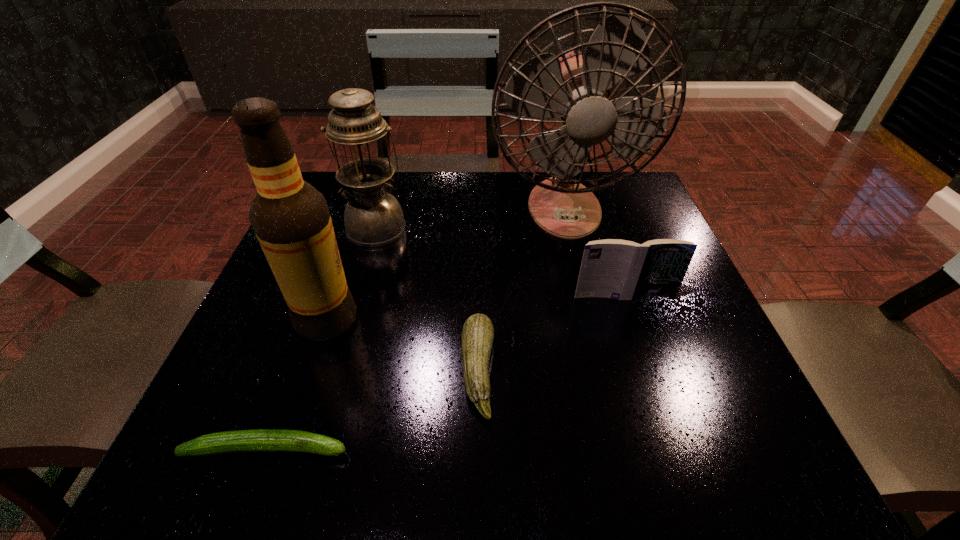
Locate an element on the screen. free space that is in between the shortest object and the fan is located at coordinates (416, 329).

Image resolution: width=960 pixels, height=540 pixels. I want to click on free spot between the farther zucchini and the alcohol, so click(402, 346).

Find the location of a particular element. This screenshot has width=960, height=540. free space between the third tallest object and the fan is located at coordinates (470, 218).

Locate an element on the screen. This screenshot has width=960, height=540. free space between the book and the shortest object is located at coordinates (445, 373).

Identify the location of vacant space that's between the fourth tallest object and the taller zucchini. This screenshot has height=540, width=960. (551, 334).

Find the location of `free point between the alcohol and the oil lamp`. free point between the alcohol and the oil lamp is located at coordinates click(x=351, y=274).

Identify the location of vacant region between the shortest object and the alcohol. Image resolution: width=960 pixels, height=540 pixels. (297, 384).

At what (x,y) coordinates should I click in order to perform the action: click on free space between the oil lamp and the book. Please return your answer as a coordinate pair (x, y). Image resolution: width=960 pixels, height=540 pixels. Looking at the image, I should click on (500, 262).

Identify the location of object that stands as the third closest to the fan. (x=477, y=336).

Find the location of a particular element. object that is the third closest to the taller zucchini is located at coordinates (291, 220).